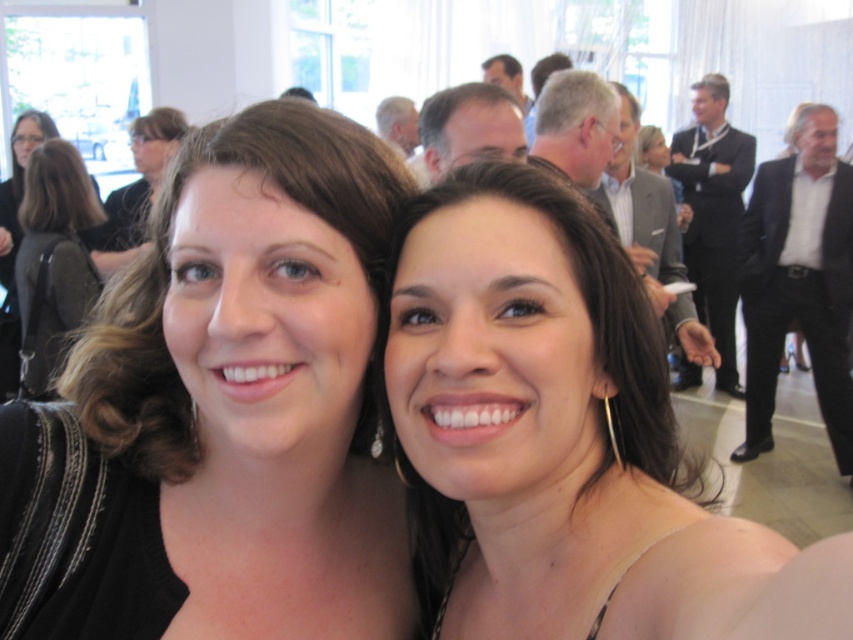
You are a photographer trying to capture a closeup shot of the woman on the right. You are currently positioned at point (807, 602). The camera you are using has a focal length of 50mm. To ensure the subject fills the frame, you need to be within 30 centimeters of her. Can you achieve this by moving closer from your current position?

The distance between point (807, 602) and the camera is 34.31 centimeters. Since the required distance to capture the closeup is within 30 centimeters, you need to move 4.31 centimeters closer to the woman on the right.

You are a photographer at the event and want to ensure both the black fabric at center and the smooth skin face at center are fully visible in your portrait. Based on their sizes, is there a risk that one might block the other in the frame?

The black fabric at center might be wider than smooth skin face at center, so there is a risk that the black fabric at center could block part of the smooth skin face at center in the frame.

You are a photographer standing at the center of the room. You want to capture a photo that includes both the black suit at right and the black leather backpack at left. The camera you are using has a maximum focal length that allows capturing objects within a 3.0 meters distance. Can you include both objects in the same frame?

The black suit at right is 2.80 meters away from the black leather backpack at left. Since the distance between them is within the camera maximum focal length of 3.0 meters, you can include both objects in the same frame.